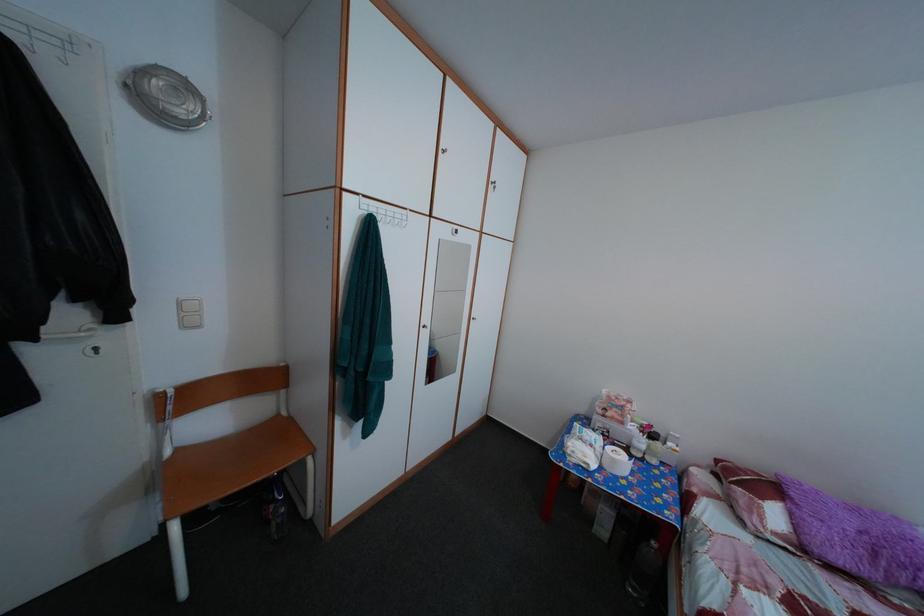
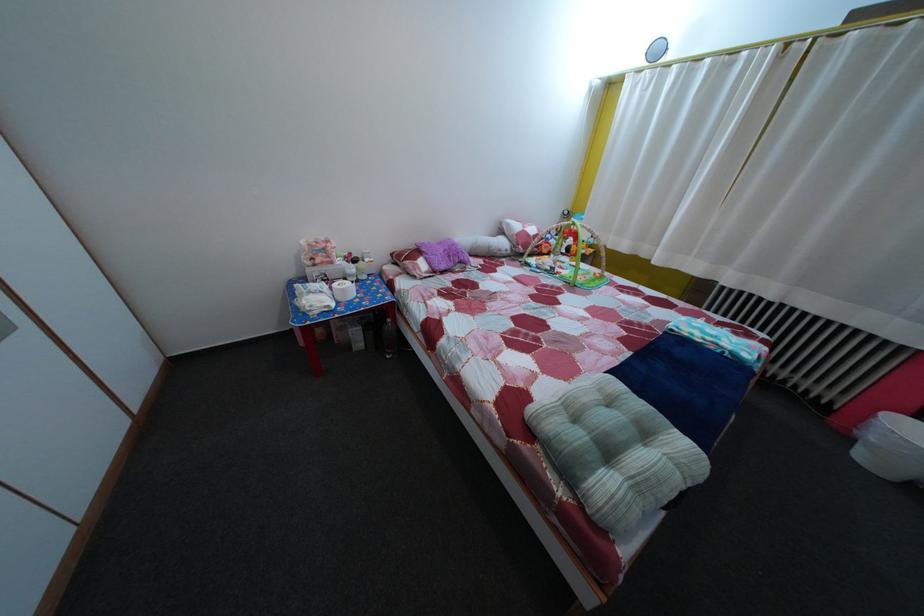
Locate, in the second image, the point that corresponds to point (618, 440) in the first image.

(335, 284)